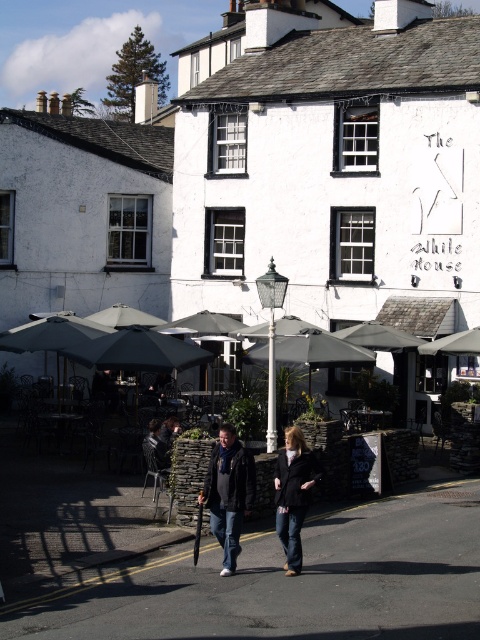
Describe the element at coordinates (320, 352) in the screenshot. I see `gray fabric umbrella at center` at that location.

Can you confirm if gray fabric umbrella at center is wider than dark grey fabric umbrella at left?

Indeed, gray fabric umbrella at center has a greater width compared to dark grey fabric umbrella at left.

The height and width of the screenshot is (640, 480). I want to click on gray fabric umbrella at center, so click(320, 352).

Between point (228, 486) and point (214, 477), which one is positioned in front?

Point (228, 486) is more forward.

The image size is (480, 640). Describe the element at coordinates (228, 493) in the screenshot. I see `dark brown leather jacket at center` at that location.

Is point (235, 560) positioned in front of point (228, 529)?

Yes, it is in front of point (228, 529).

Identify the location of dark brown leather jacket at center. This screenshot has width=480, height=640. (228, 493).

Which is behind, point (283, 477) or point (36, 316)?

The point (36, 316) is behind.

Image resolution: width=480 pixels, height=640 pixels. What do you see at coordinates (294, 493) in the screenshot?
I see `denim jacket at center` at bounding box center [294, 493].

At what (x,y) coordinates should I click in order to perform the action: click on denim jacket at center. Please return your answer as a coordinate pair (x, y). Looking at the image, I should click on (294, 493).